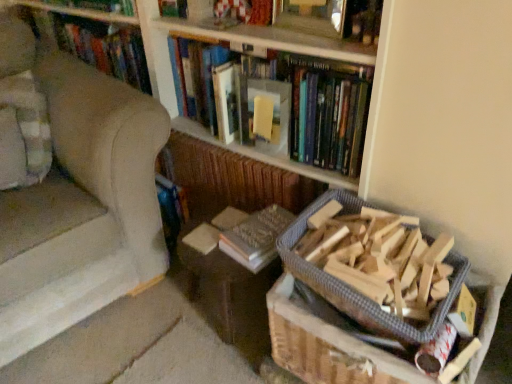
What do you see at coordinates (266, 115) in the screenshot?
I see `yellow paper at upper center` at bounding box center [266, 115].

Where is `hardcover book at center, the third book positioned from the top`? hardcover book at center, the third book positioned from the top is located at coordinates (256, 237).

At what (x,y) coordinates should I click in order to perform the action: click on metallic silver picture frame at upper center. Please return your answer as a coordinate pair (x, y). Image resolution: width=512 pixels, height=384 pixels. Looking at the image, I should click on (311, 16).

I want to click on wooden bookcase at upper center, so click(232, 41).

In terms of size, does metallic silver picture frame at upper center appear bigger or smaller than brown cardboard box at lower right?

In the image, metallic silver picture frame at upper center appears to be smaller than brown cardboard box at lower right.

Is metallic silver picture frame at upper center placed right next to brown cardboard box at lower right?

No, metallic silver picture frame at upper center is not with brown cardboard box at lower right.

Can you confirm if metallic silver picture frame at upper center is wider than brown cardboard box at lower right?

No.

Consider the image. Is metallic silver picture frame at upper center at the left side of brown cardboard box at lower right?

Yes.

What's the angular difference between wooden bookcase at upper center and metallic silver picture frame at upper center's facing directions?

The facing directions of wooden bookcase at upper center and metallic silver picture frame at upper center are 8.42 degrees apart.

Consider the image. Considering the sizes of wooden bookcase at upper center and metallic silver picture frame at upper center in the image, is wooden bookcase at upper center bigger or smaller than metallic silver picture frame at upper center?

In the image, wooden bookcase at upper center appears to be larger than metallic silver picture frame at upper center.

Can you see wooden bookcase at upper center touching metallic silver picture frame at upper center?

No, wooden bookcase at upper center is not beside metallic silver picture frame at upper center.

Is wooden bookcase at upper center taller than metallic silver picture frame at upper center?

Correct, wooden bookcase at upper center is much taller as metallic silver picture frame at upper center.

From a real-world perspective, is hardcover book at center, positioned as the 1th book in bottom-to-top order, beneath beige fabric armchair at left?

Yes, from a real-world perspective, hardcover book at center, positioned as the 1th book in bottom-to-top order, is below beige fabric armchair at left.

Is the surface of hardcover book at center, the third book positioned from the top, in direct contact with beige fabric armchair at left?

hardcover book at center, the third book positioned from the top, and beige fabric armchair at left are clearly separated.

Is hardcover book at center, the third book positioned from the top, located outside beige fabric armchair at left?

Yes, hardcover book at center, the third book positioned from the top, is located beyond the bounds of beige fabric armchair at left.

Can you confirm if wooden bookcase at upper center is wider than beige fabric armchair at left?

No, wooden bookcase at upper center is not wider than beige fabric armchair at left.

Choose the correct answer: Is wooden bookcase at upper center inside beige fabric armchair at left or outside it?

wooden bookcase at upper center is not inside beige fabric armchair at left, it's outside.

From the image's perspective, which is above, wooden bookcase at upper center or beige fabric armchair at left?

wooden bookcase at upper center, from the image's perspective.

In the scene shown: Is wooden bookcase at upper center beside beige fabric armchair at left?

wooden bookcase at upper center and beige fabric armchair at left are not in contact.

Does hardcover book at upper center, which is the second book from top to bottom, have a lesser height compared to metallic silver picture frame at upper center?

In fact, hardcover book at upper center, which is the second book from top to bottom, may be taller than metallic silver picture frame at upper center.

From the image's perspective, is hardcover book at upper center, the second book positioned from the bottom, under metallic silver picture frame at upper center?

Indeed, from the image's perspective, hardcover book at upper center, the second book positioned from the bottom, is shown beneath metallic silver picture frame at upper center.

Is hardcover book at upper center, which is the second book from top to bottom, aimed at metallic silver picture frame at upper center?

No, hardcover book at upper center, which is the second book from top to bottom, is not oriented towards metallic silver picture frame at upper center.

In the image, is hardcover book at upper center, the second book positioned from the bottom, on the left side or the right side of metallic silver picture frame at upper center?

From the image, it's evident that hardcover book at upper center, the second book positioned from the bottom, is to the left of metallic silver picture frame at upper center.

Which of these two, wooden frame at upper center, which is the 1th book in top-to-bottom order, or metallic silver picture frame at upper center, is wider?

With larger width is wooden frame at upper center, which is the 1th book in top-to-bottom order.

Is wooden frame at upper center, which is the 1th book in top-to-bottom order, looking in the opposite direction of metallic silver picture frame at upper center?

That's not correct — wooden frame at upper center, which is the 1th book in top-to-bottom order, is not looking away from metallic silver picture frame at upper center.

Is point (300, 7) closer to viewer compared to point (316, 27)?

No, (300, 7) is behind (316, 27).

Is wooden frame at upper center, which is the 1th book in top-to-bottom order, inside the boundaries of metallic silver picture frame at upper center, or outside?

The correct answer is: outside.

From a real-world perspective, is brown cardboard box at lower right below wooden bookcase at upper center?

Indeed, from a real-world perspective, brown cardboard box at lower right is positioned beneath wooden bookcase at upper center.

Considering the relative positions of brown cardboard box at lower right and wooden bookcase at upper center in the image provided, is brown cardboard box at lower right to the left of wooden bookcase at upper center from the viewer's perspective?

No, brown cardboard box at lower right is not to the left of wooden bookcase at upper center.

From the image's perspective, which object appears higher, brown cardboard box at lower right or wooden bookcase at upper center?

wooden bookcase at upper center appears higher in the image.

Is point (286, 350) farther from viewer compared to point (339, 58)?

That is True.

In the image, there is a metallic silver picture frame at upper center. Find the location of `cardboard box below it (from a real-world perspective)`. cardboard box below it (from a real-world perspective) is located at coordinates (327, 346).

Find the location of a particular element. picture frame on the right of the wooden bookcase at upper center is located at coordinates (311, 16).

Estimate the real-world distances between objects in this image. Which object is further from hardcover book at upper center, which is the second book from top to bottom, yellow paper at upper center or wooden bookcase at upper center?

yellow paper at upper center is further to hardcover book at upper center, which is the second book from top to bottom.

Based on the photo, looking at the image, which one is located further to hardcover book at center, the third book positioned from the top, wooden bookcase at upper center or wooden frame at upper center, acting as the 3th book starting from the bottom?

The object further to hardcover book at center, the third book positioned from the top, is wooden frame at upper center, acting as the 3th book starting from the bottom.

Estimate the real-world distances between objects in this image. Which object is further from metallic silver picture frame at upper center, wooden frame at upper center, acting as the 3th book starting from the bottom, or wooden bookcase at upper center?

wooden bookcase at upper center is positioned further to the anchor metallic silver picture frame at upper center.

Considering their positions, is metallic silver picture frame at upper center positioned closer to wooden bookcase at upper center than yellow paper at upper center?

Based on the image, metallic silver picture frame at upper center appears to be nearer to wooden bookcase at upper center.

Looking at the image, which one is located further to hardcover book at center, positioned as the 1th book in bottom-to-top order, yellow paper at upper center or hardcover book at upper center, which is the second book from top to bottom?

hardcover book at upper center, which is the second book from top to bottom, is further to hardcover book at center, positioned as the 1th book in bottom-to-top order.

From the image, which object appears to be nearer to metallic silver picture frame at upper center, hardcover book at upper center, which is the second book from top to bottom, or wooden bookcase at upper center?

wooden bookcase at upper center is positioned closer to the anchor metallic silver picture frame at upper center.

Considering their positions, is wooden bookcase at upper center positioned closer to metallic silver picture frame at upper center than hardcover book at upper center, which is the second book from top to bottom?

wooden bookcase at upper center lies closer to metallic silver picture frame at upper center than the other object.

Based on their spatial positions, is beige fabric armchair at left or hardcover book at upper center, the second book positioned from the bottom, further from metallic silver picture frame at upper center?

Based on the image, beige fabric armchair at left appears to be further to metallic silver picture frame at upper center.

This screenshot has width=512, height=384. In order to click on bookcase situated between beige fabric armchair at left and metallic silver picture frame at upper center from left to right in this screenshot , I will do `click(232, 41)`.

Locate an element on the screen. bookcase between beige fabric armchair at left and hardcover book at center, positioned as the 1th book in bottom-to-top order is located at coordinates [232, 41].

What are the coordinates of `paperback book between wooden bookcase at upper center and brown cardboard box at lower right in the up-down direction` in the screenshot? It's located at (266, 115).

Image resolution: width=512 pixels, height=384 pixels. I want to click on book between metallic silver picture frame at upper center and yellow paper at upper center in the up-down direction, so click(x=282, y=103).